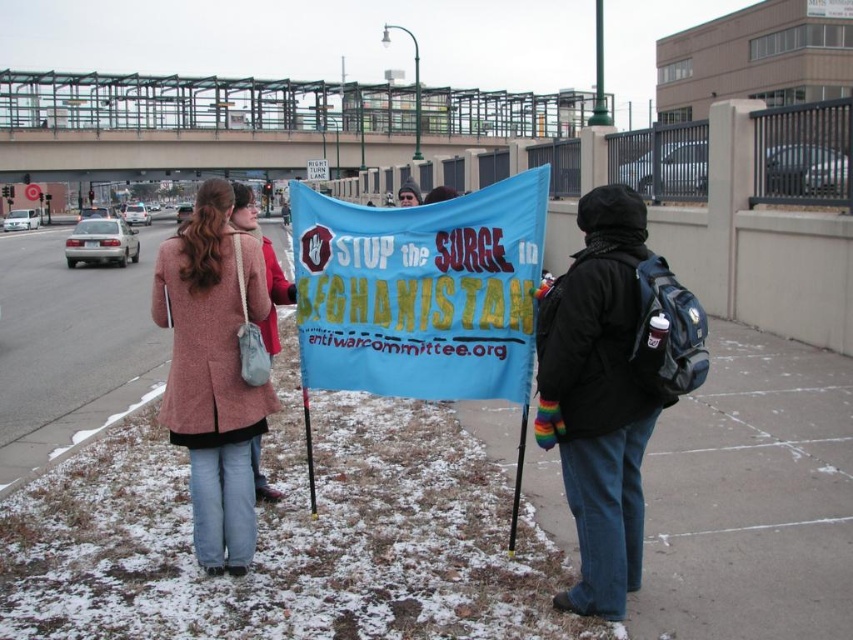
You are a photographer trying to capture a clear shot of the black fleece jacket at center without the blue fabric banner at center blocking it. What adjustment should you make to your camera angle?

To avoid the blue fabric banner at center blocking the shot, you should lower your camera angle since the blue fabric banner at center is located above the black fleece jacket at center.

You are a photographer trying to capture a photo of the protest scene. You want to ensure both the blue fabric banner at center and the black fleece jacket at center are clearly visible in the frame. Given their positions and sizes, do you think the banner might block the view of the jacket?

The blue fabric banner at center might be wider than black fleece jacket at center, so there is a possibility that the banner could block the view of the jacket depending on their exact positions and angles.